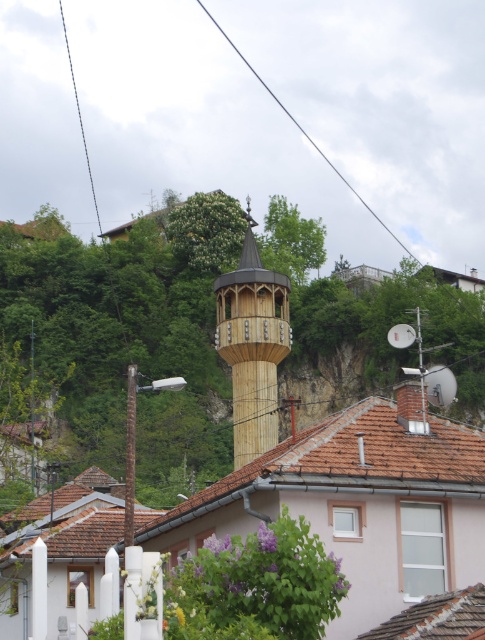
Question: Which of the following is the farthest from the observer?

Choices:
 (A) (335, 170)
 (B) (64, 29)
 (C) (241, 442)

Answer: (B)

Question: Can you confirm if wooden minaret at center is smaller than black wire at upper left?

Choices:
 (A) yes
 (B) no

Answer: (A)

Question: Which point is farther to the camera?

Choices:
 (A) (275, 99)
 (B) (65, 36)
 (C) (238, 362)

Answer: (B)

Question: Is wooden minaret at center thinner than black wire at upper left?

Choices:
 (A) yes
 (B) no

Answer: (A)

Question: Which point appears farthest from the camera in this image?

Choices:
 (A) (97, 216)
 (B) (237, 344)
 (C) (287, 109)

Answer: (C)

Question: In this image, where is wooden minaret at center located relative to black wire at upper center?

Choices:
 (A) right
 (B) left

Answer: (B)